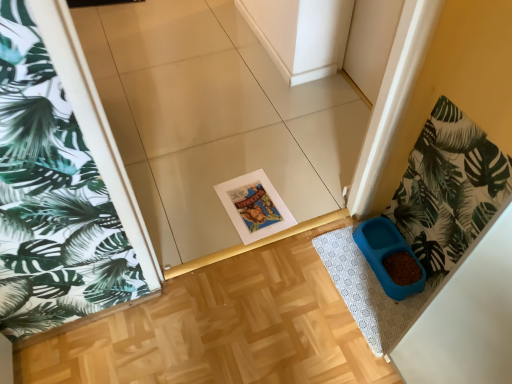
Identify the location of free space that is to the left of blue plastic pet food bowl at lower right. (335, 265).